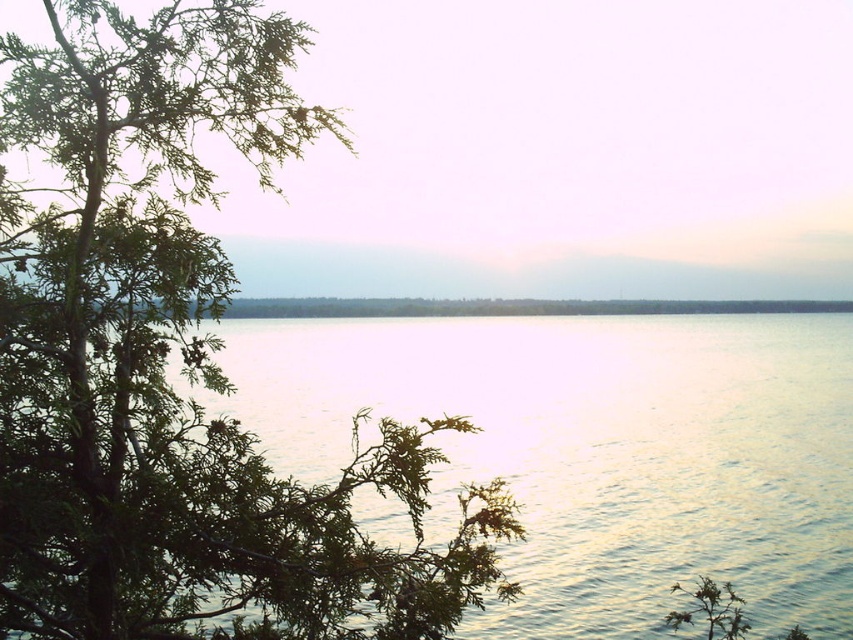
You are standing at the lakeside and see two points marked on the image. The first point is at coordinates point (450, 556) and the second is at point (737, 316). Which point is closer to you?

Point (450, 556) is in front of point (737, 316), so the first point is closer to you.

From the picture: You are an artist trying to paint this lakeside scene. You want to ensure the green textured leaves at left and the glistening silver water at center are proportionally accurate. Based on the scene, which object should you make taller in your painting?

The green textured leaves at left should be made taller in the painting since it is much taller than the glistening silver water at center according to the description.